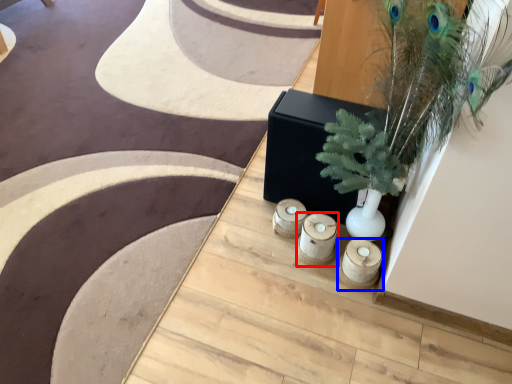
Question: Among these objects, which one is nearest to the camera, candle holder (highlighted by a red box) or candle holder (highlighted by a blue box)?

Choices:
 (A) candle holder
 (B) candle holder

Answer: (B)